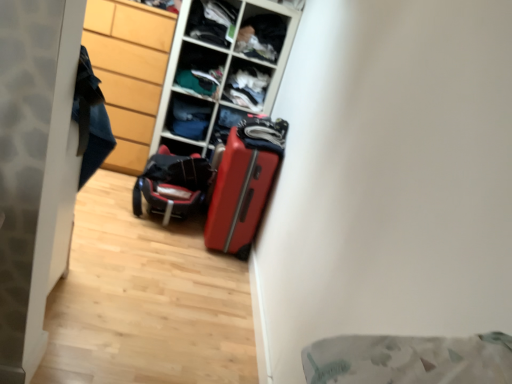
Question: From a real-world perspective, does dark fabric clothes at upper center, positioned as the 4th shelf in bottom-to-top order, stand above wooden cabinet at left?

Choices:
 (A) no
 (B) yes

Answer: (B)

Question: Can you confirm if dark fabric clothes at upper center, positioned as the 4th shelf in bottom-to-top order, is taller than wooden cabinet at left?

Choices:
 (A) no
 (B) yes

Answer: (A)

Question: Considering the relative sizes of dark fabric clothes at upper center, positioned as the 4th shelf in bottom-to-top order, and wooden cabinet at left in the image provided, is dark fabric clothes at upper center, positioned as the 4th shelf in bottom-to-top order, shorter than wooden cabinet at left?

Choices:
 (A) no
 (B) yes

Answer: (B)

Question: Is wooden cabinet at left inside dark fabric clothes at upper center, which ranks as the second shelf in top-to-bottom order?

Choices:
 (A) no
 (B) yes

Answer: (A)

Question: Is matte plastic shelf at upper center, the 5th shelf ordered from the bottom, wider or thinner than matte plastic cabinet at center?

Choices:
 (A) wide
 (B) thin

Answer: (B)

Question: Visually, is matte plastic shelf at upper center, the 5th shelf ordered from the bottom, positioned to the left or to the right of matte plastic cabinet at center?

Choices:
 (A) left
 (B) right

Answer: (A)

Question: Is point (228, 8) closer or farther from the camera than point (247, 105)?

Choices:
 (A) closer
 (B) farther

Answer: (A)

Question: From a real-world perspective, is matte plastic shelf at upper center, the 1th shelf in the top-to-bottom sequence, physically located above or below matte plastic cabinet at center?

Choices:
 (A) above
 (B) below

Answer: (A)

Question: From a real-world perspective, is dark fabric clothes at upper center, which ranks as the second shelf in top-to-bottom order, positioned above or below shiny red suitcase at center?

Choices:
 (A) below
 (B) above

Answer: (B)

Question: Considering the positions of dark fabric clothes at upper center, positioned as the 4th shelf in bottom-to-top order, and shiny red suitcase at center in the image, is dark fabric clothes at upper center, positioned as the 4th shelf in bottom-to-top order, taller or shorter than shiny red suitcase at center?

Choices:
 (A) tall
 (B) short

Answer: (B)

Question: Is dark fabric clothes at upper center, positioned as the 4th shelf in bottom-to-top order, situated inside shiny red suitcase at center or outside?

Choices:
 (A) outside
 (B) inside

Answer: (A)

Question: Considering the positions of point (241, 44) and point (242, 233), is point (241, 44) closer or farther from the camera than point (242, 233)?

Choices:
 (A) closer
 (B) farther

Answer: (B)

Question: Considering their positions, is shiny red suitcase at center located in front of or behind matte plastic shelf at upper center, the 1th shelf in the top-to-bottom sequence?

Choices:
 (A) behind
 (B) front

Answer: (B)

Question: In terms of size, does shiny red suitcase at center appear bigger or smaller than matte plastic shelf at upper center, the 1th shelf in the top-to-bottom sequence?

Choices:
 (A) big
 (B) small

Answer: (A)